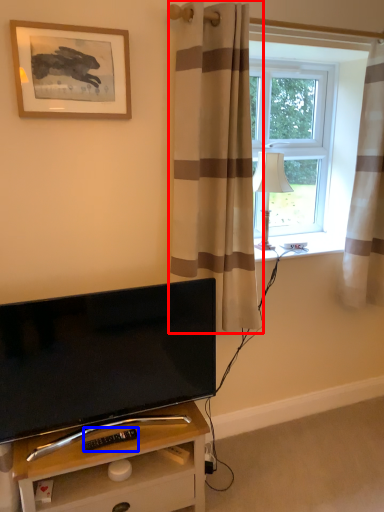
Question: Which point is further to the camera, curtain (highlighted by a red box) or remote control (highlighted by a blue box)?

Choices:
 (A) curtain
 (B) remote control

Answer: (B)